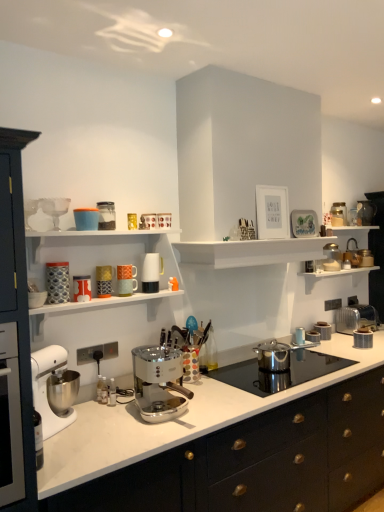
What do you see at coordinates (46, 388) in the screenshot?
I see `white plastic mixer at left, positioned as the 2th mixer in right-to-left order` at bounding box center [46, 388].

Find the location of `clear glass jar at upper center, which appears as the third kitchen appliance when viewed from the left`. clear glass jar at upper center, which appears as the third kitchen appliance when viewed from the left is located at coordinates [x=106, y=215].

What is the approximate width of silver metallic canister at right, the ninth kitchen appliance when ordered from front to back?

It is 5.71 inches.

You are a GUI agent. You are given a task and a screenshot of the screen. Output one action in this format:
    pyautogui.click(x=<x>, y=<y>)
    Task: Click on the matte ceramic mug at upper center, positioned as the 6th kitchen appliance in front-to-back order
    
    Given the screenshot: What is the action you would take?
    pyautogui.click(x=164, y=220)

Locate an element on the screen. This screenshot has height=512, width=384. matte ceramic mug at upper center, marked as the eleventh kitchen appliance in a right-to-left arrangement is located at coordinates (82, 288).

Image resolution: width=384 pixels, height=512 pixels. I want to click on stainless steel pot at center, the fifth kitchen appliance viewed from the back, so click(x=273, y=355).

At what (x,y) coordinates should I click in order to perform the action: click on white plastic mixer at left, the 1th mixer viewed from the left. Please return your answer as a coordinate pair (x, y). The height and width of the screenshot is (512, 384). Looking at the image, I should click on (46, 388).

Is point (51, 202) farther from viewer compared to point (284, 362)?

No, (51, 202) is in front of (284, 362).

From the picture: From a real-world perspective, is clear glass goblet at upper left, which is the seventh appliance in bottom-to-top order, positioned above or below stainless steel pot at center, arranged as the eighth kitchen appliance when viewed from the left?

Clearly, from a real-world perspective, clear glass goblet at upper left, which is the seventh appliance in bottom-to-top order, is above stainless steel pot at center, arranged as the eighth kitchen appliance when viewed from the left.

Is clear glass goblet at upper left, which ranks as the 1th appliance in left-to-right order, shorter than stainless steel pot at center, placed as the 8th kitchen appliance when sorted from front to back?

No, clear glass goblet at upper left, which ranks as the 1th appliance in left-to-right order, is not shorter than stainless steel pot at center, placed as the 8th kitchen appliance when sorted from front to back.

Which is more to the right, clear glass goblet at upper left, which ranks as the 1th appliance in left-to-right order, or stainless steel pot at center, placed as the 8th kitchen appliance when sorted from front to back?

stainless steel pot at center, placed as the 8th kitchen appliance when sorted from front to back, is more to the right.

Is matte ceramic mug at upper center, positioned as the 6th kitchen appliance in front-to-back order, inside matte ceramic mug at upper center, marked as the seventh appliance in a top-to-bottom arrangement?

No, matte ceramic mug at upper center, positioned as the 6th kitchen appliance in front-to-back order, is not surrounded by matte ceramic mug at upper center, marked as the seventh appliance in a top-to-bottom arrangement.

From a real-world perspective, relative to matte ceramic mug at upper center, which is the 7th kitchen appliance in back-to-front order, is matte ceramic mug at upper center, marked as the seventh appliance in a top-to-bottom arrangement, vertically above or below?

matte ceramic mug at upper center, marked as the seventh appliance in a top-to-bottom arrangement, is situated lower than matte ceramic mug at upper center, which is the 7th kitchen appliance in back-to-front order, in the real world.

Can you confirm if matte ceramic mug at upper center, which is the third appliance in front-to-back order, is positioned to the right of matte ceramic mug at upper center, the 7th kitchen appliance viewed from the left?

Incorrect, matte ceramic mug at upper center, which is the third appliance in front-to-back order, is not on the right side of matte ceramic mug at upper center, the 7th kitchen appliance viewed from the left.

There is a white matte shelf at upper center. In order to click on the 3rd kitchen appliance below it (from the image's perspective) in this screenshot , I will do `click(82, 288)`.

From the image's perspective, is white matte shelf at upper center located beneath matte ceramic mug at upper center, which is the second kitchen appliance from front to back?

Actually, white matte shelf at upper center appears above matte ceramic mug at upper center, which is the second kitchen appliance from front to back, in the image.

Based on the photo, does white matte shelf at upper center turn towards matte ceramic mug at upper center, which is the second kitchen appliance from front to back?

No, white matte shelf at upper center does not turn towards matte ceramic mug at upper center, which is the second kitchen appliance from front to back.

Which object is closer to the camera taking this photo, white matte shelf at upper center or matte ceramic mug at upper center, the eleventh kitchen appliance when ordered from back to front?

matte ceramic mug at upper center, the eleventh kitchen appliance when ordered from back to front, is in front.

From the image's perspective, who appears lower, silver metallic canister at right, positioned as the 4th kitchen appliance in back-to-front order, or silver metallic toaster at right, which is the twelfth kitchen appliance from left to right?

silver metallic canister at right, positioned as the 4th kitchen appliance in back-to-front order.

Identify the location of the 2nd kitchen appliance behind the silver metallic canister at right, the ninth kitchen appliance when ordered from front to back. The image size is (384, 512). (356, 318).

Could you tell me if silver metallic canister at right, which appears as the eleventh kitchen appliance when viewed from the left, is turned towards silver metallic toaster at right, arranged as the second kitchen appliance when viewed from the back?

No, silver metallic canister at right, which appears as the eleventh kitchen appliance when viewed from the left, is not turned towards silver metallic toaster at right, arranged as the second kitchen appliance when viewed from the back.

Is metallic gold coffee maker at upper center, which ranks as the 9th kitchen appliance in back-to-front order, not within white marble countertop at center?

Yes, metallic gold coffee maker at upper center, which ranks as the 9th kitchen appliance in back-to-front order, is located beyond the bounds of white marble countertop at center.

Considering the sizes of metallic gold coffee maker at upper center, positioned as the 4th kitchen appliance in front-to-back order, and white marble countertop at center in the image, is metallic gold coffee maker at upper center, positioned as the 4th kitchen appliance in front-to-back order, wider or thinner than white marble countertop at center?

Considering their sizes, metallic gold coffee maker at upper center, positioned as the 4th kitchen appliance in front-to-back order, looks slimmer than white marble countertop at center.

Can you see metallic gold coffee maker at upper center, positioned as the 4th kitchen appliance in front-to-back order, touching white marble countertop at center?

There is a gap between metallic gold coffee maker at upper center, positioned as the 4th kitchen appliance in front-to-back order, and white marble countertop at center.

Considering the relative sizes of metallic gold coffee maker at upper center, positioned as the 4th kitchen appliance in front-to-back order, and white marble countertop at center in the image provided, is metallic gold coffee maker at upper center, positioned as the 4th kitchen appliance in front-to-back order, taller than white marble countertop at center?

In fact, metallic gold coffee maker at upper center, positioned as the 4th kitchen appliance in front-to-back order, may be shorter than white marble countertop at center.

Considering the relative sizes of silver metallic canister at right, which appears as the eleventh kitchen appliance when viewed from the left, and matte ceramic mug at upper center, marked as the 2th kitchen appliance in a left-to-right arrangement, in the image provided, is silver metallic canister at right, which appears as the eleventh kitchen appliance when viewed from the left, smaller than matte ceramic mug at upper center, marked as the 2th kitchen appliance in a left-to-right arrangement,?

No, silver metallic canister at right, which appears as the eleventh kitchen appliance when viewed from the left, is not smaller than matte ceramic mug at upper center, marked as the 2th kitchen appliance in a left-to-right arrangement.

Could you tell me if silver metallic canister at right, positioned as the 4th kitchen appliance in back-to-front order, is facing matte ceramic mug at upper center, marked as the eleventh kitchen appliance in a right-to-left arrangement?

No, silver metallic canister at right, positioned as the 4th kitchen appliance in back-to-front order, is not turned towards matte ceramic mug at upper center, marked as the eleventh kitchen appliance in a right-to-left arrangement.

Is silver metallic canister at right, the 2th kitchen appliance from the right, further to camera compared to matte ceramic mug at upper center, which is the second kitchen appliance from front to back?

Yes, it is behind matte ceramic mug at upper center, which is the second kitchen appliance from front to back.

Would you say matte ceramic mug at upper center, which is the third appliance in front-to-back order, is outside white marble countertop at center?

Indeed, matte ceramic mug at upper center, which is the third appliance in front-to-back order, is completely outside white marble countertop at center.

Considering the sizes of objects matte ceramic mug at upper center, marked as the seventh appliance in a top-to-bottom arrangement, and white marble countertop at center in the image provided, who is thinner, matte ceramic mug at upper center, marked as the seventh appliance in a top-to-bottom arrangement, or white marble countertop at center?

matte ceramic mug at upper center, marked as the seventh appliance in a top-to-bottom arrangement, is thinner.

Looking at this image, is matte ceramic mug at upper center, marked as the seventh appliance in a top-to-bottom arrangement, facing away from white marble countertop at center?

matte ceramic mug at upper center, marked as the seventh appliance in a top-to-bottom arrangement, does not have its back to white marble countertop at center.

Which is behind, point (130, 283) or point (332, 335)?

The point (332, 335) is behind.

Starting from the stainless steel pot at center, arranged as the eighth kitchen appliance when viewed from the left, which appliance is the 3rd one to the left? Please provide its 2D coordinates.

[(55, 209)]

Identify the location of the 4th kitchen appliance to the right of the matte ceramic mug at upper center, which is the third appliance in front-to-back order, starting your count from the anchor. pyautogui.click(x=164, y=220).

From the picture: When comparing their distances from silver metallic toaster at right, arranged as the second kitchen appliance when viewed from the back, does matte ceramic jar at upper center, the 7th appliance in the right-to-left sequence, or matte ceramic mug at upper center, which is the second kitchen appliance from front to back, seem closer?

matte ceramic mug at upper center, which is the second kitchen appliance from front to back.

Which object lies nearer to the anchor point stainless steel pot at center, placed as the 8th kitchen appliance when sorted from front to back, matte ceramic mug at upper center, which is the second kitchen appliance from front to back, or white marble countertop at center?

Based on the image, white marble countertop at center appears to be nearer to stainless steel pot at center, placed as the 8th kitchen appliance when sorted from front to back.

Which object lies nearer to the anchor point matte ceramic mug at upper center, the eleventh kitchen appliance when ordered from back to front, white plastic mixer at left, positioned as the 2th mixer in right-to-left order, or stainless steel pot at center, arranged as the eighth kitchen appliance when viewed from the left?

The object closer to matte ceramic mug at upper center, the eleventh kitchen appliance when ordered from back to front, is white plastic mixer at left, positioned as the 2th mixer in right-to-left order.

Based on the photo, from the image, which object appears to be nearer to metallic silver toaster at upper right, which ranks as the 9th kitchen appliance in left-to-right order, patterned ceramic mug at left, which appears as the first kitchen appliance when viewed from the left, or matte ceramic mug at upper center, marked as the 2th kitchen appliance in a left-to-right arrangement?

Among the two, matte ceramic mug at upper center, marked as the 2th kitchen appliance in a left-to-right arrangement, is located nearer to metallic silver toaster at upper right, which ranks as the 9th kitchen appliance in left-to-right order.

Based on their spatial positions, is translucent glass jar at upper right, the eighth appliance ordered from the bottom, or white plastic mixer at left, positioned as the 2th mixer in right-to-left order, further from white marble countertop at center?

translucent glass jar at upper right, the eighth appliance ordered from the bottom, lies further to white marble countertop at center than the other object.

Estimate the real-world distances between objects in this image. Which object is closer to white glossy espresso machine at center, marked as the 2th mixer in a left-to-right arrangement, stainless steel pot at center, arranged as the eighth kitchen appliance when viewed from the left, or patterned ceramic mug at left, which appears as the first kitchen appliance when viewed from the left?

patterned ceramic mug at left, which appears as the first kitchen appliance when viewed from the left, lies closer to white glossy espresso machine at center, marked as the 2th mixer in a left-to-right arrangement, than the other object.

Looking at this image, based on their spatial positions, is white plastic mixer at left, the 1th mixer viewed from the left, or metallic gold canister at upper right, the 10th kitchen appliance when ordered from left to right, closer to translucent glass jar at upper right, the first appliance viewed from the top?

metallic gold canister at upper right, the 10th kitchen appliance when ordered from left to right.

Estimate the real-world distances between objects in this image. Which object is closer to matte ceramic mug at upper center, which is the second kitchen appliance from front to back, white glossy espresso machine at center, the first mixer viewed from the right, or metallic gold coffee maker at upper center, which ranks as the 9th kitchen appliance in back-to-front order?

metallic gold coffee maker at upper center, which ranks as the 9th kitchen appliance in back-to-front order.

Identify the location of mixer situated between matte ceramic mug at upper center, which is the second kitchen appliance from front to back, and metallic gold canister at upper right, the 3th kitchen appliance from the right, from left to right. (159, 383).

This screenshot has width=384, height=512. Identify the location of shelf between matte ceramic jar at upper center, which appears as the seventh appliance when viewed from the back, and silver metallic canister at right, which appears as the eleventh kitchen appliance when viewed from the left. (251, 252).

Where is `shelf between white glossy kettle at upper center, which is the eighth kitchen appliance in back-to-front order, and silver metallic canister at right, positioned as the 4th kitchen appliance in back-to-front order`? shelf between white glossy kettle at upper center, which is the eighth kitchen appliance in back-to-front order, and silver metallic canister at right, positioned as the 4th kitchen appliance in back-to-front order is located at coordinates (251, 252).

The image size is (384, 512). I want to click on mixer between matte ceramic mug at upper center, which is the 7th kitchen appliance in back-to-front order, and translucent glass jar at upper right, acting as the 8th appliance starting from the left, from left to right, so click(159, 383).